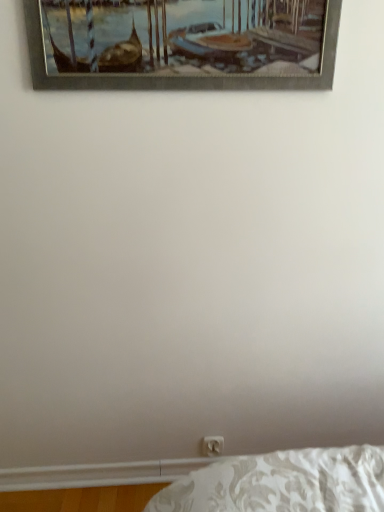
Describe the element at coordinates (213, 445) in the screenshot. This screenshot has width=384, height=512. I see `white plastic electric outlet at lower center` at that location.

Find the location of `white plastic electric outlet at lower center`. white plastic electric outlet at lower center is located at coordinates (213, 445).

This screenshot has width=384, height=512. What are the coordinates of `metallic silver picture frame at upper center` in the screenshot? It's located at (182, 44).

Image resolution: width=384 pixels, height=512 pixels. Describe the element at coordinates (182, 44) in the screenshot. I see `metallic silver picture frame at upper center` at that location.

Where is `white plastic electric outlet at lower center`? white plastic electric outlet at lower center is located at coordinates (213, 445).

Considering the relative positions of metallic silver picture frame at upper center and white plastic electric outlet at lower center in the image provided, is metallic silver picture frame at upper center to the left or to the right of white plastic electric outlet at lower center?

metallic silver picture frame at upper center is to the left of white plastic electric outlet at lower center.

Relative to white plastic electric outlet at lower center, is metallic silver picture frame at upper center in front or behind?

Clearly, metallic silver picture frame at upper center is in front of white plastic electric outlet at lower center.

Is point (44, 18) farther from viewer compared to point (212, 437)?

No, (44, 18) is closer to viewer.

From the image's perspective, is metallic silver picture frame at upper center located above white plastic electric outlet at lower center?

Correct, metallic silver picture frame at upper center appears higher than white plastic electric outlet at lower center in the image.

From a real-world perspective, is metallic silver picture frame at upper center physically located above or below white plastic electric outlet at lower center?

In terms of real-world spatial position, metallic silver picture frame at upper center is above white plastic electric outlet at lower center.

Considering the relative sizes of metallic silver picture frame at upper center and white plastic electric outlet at lower center in the image provided, is metallic silver picture frame at upper center thinner than white plastic electric outlet at lower center?

No.

In terms of height, does metallic silver picture frame at upper center look taller or shorter compared to white plastic electric outlet at lower center?

Clearly, metallic silver picture frame at upper center is taller compared to white plastic electric outlet at lower center.

Consider the image. Does metallic silver picture frame at upper center have a smaller size compared to white plastic electric outlet at lower center?

No.

Is metallic silver picture frame at upper center not inside white plastic electric outlet at lower center?

Yes, metallic silver picture frame at upper center is located beyond the bounds of white plastic electric outlet at lower center.

In the scene shown: Is metallic silver picture frame at upper center beside white plastic electric outlet at lower center?

metallic silver picture frame at upper center and white plastic electric outlet at lower center are not in contact.

Is metallic silver picture frame at upper center facing away from white plastic electric outlet at lower center?

No, metallic silver picture frame at upper center's orientation is not away from white plastic electric outlet at lower center.

Locate an element on the screen. This screenshot has height=512, width=384. picture frame to the left of white plastic electric outlet at lower center is located at coordinates (182, 44).

Which object is positioned more to the right, white plastic electric outlet at lower center or metallic silver picture frame at upper center?

white plastic electric outlet at lower center.

Which object is more forward, white plastic electric outlet at lower center or metallic silver picture frame at upper center?

metallic silver picture frame at upper center.

Is point (211, 449) behind point (299, 42)?

Yes, it is.

Looking at this image, from the image's perspective, is white plastic electric outlet at lower center located above or below metallic silver picture frame at upper center?

white plastic electric outlet at lower center is below metallic silver picture frame at upper center.

From a real-world perspective, is white plastic electric outlet at lower center above or below metallic silver picture frame at upper center?

white plastic electric outlet at lower center is situated lower than metallic silver picture frame at upper center in the real world.

Considering the sizes of objects white plastic electric outlet at lower center and metallic silver picture frame at upper center in the image provided, who is wider, white plastic electric outlet at lower center or metallic silver picture frame at upper center?

Wider between the two is metallic silver picture frame at upper center.

Considering the relative sizes of white plastic electric outlet at lower center and metallic silver picture frame at upper center in the image provided, is white plastic electric outlet at lower center taller than metallic silver picture frame at upper center?

In fact, white plastic electric outlet at lower center may be shorter than metallic silver picture frame at upper center.

Can you confirm if white plastic electric outlet at lower center is smaller than metallic silver picture frame at upper center?

Yes.

Which is correct: white plastic electric outlet at lower center is inside metallic silver picture frame at upper center, or outside of it?

white plastic electric outlet at lower center is located beyond the bounds of metallic silver picture frame at upper center.

Does white plastic electric outlet at lower center touch metallic silver picture frame at upper center?

No, white plastic electric outlet at lower center is not with metallic silver picture frame at upper center.

Is white plastic electric outlet at lower center looking in the opposite direction of metallic silver picture frame at upper center?

That's not correct — white plastic electric outlet at lower center is not looking away from metallic silver picture frame at upper center.

At what (x,y) coordinates should I click in order to perform the action: click on picture frame above the white plastic electric outlet at lower center (from the image's perspective). Please return your answer as a coordinate pair (x, y). The image size is (384, 512). Looking at the image, I should click on (182, 44).

I want to click on electric outlet that appears below the metallic silver picture frame at upper center (from the image's perspective), so click(x=213, y=445).

Where is `electric outlet lying on the right of metallic silver picture frame at upper center`? The image size is (384, 512). electric outlet lying on the right of metallic silver picture frame at upper center is located at coordinates (213, 445).